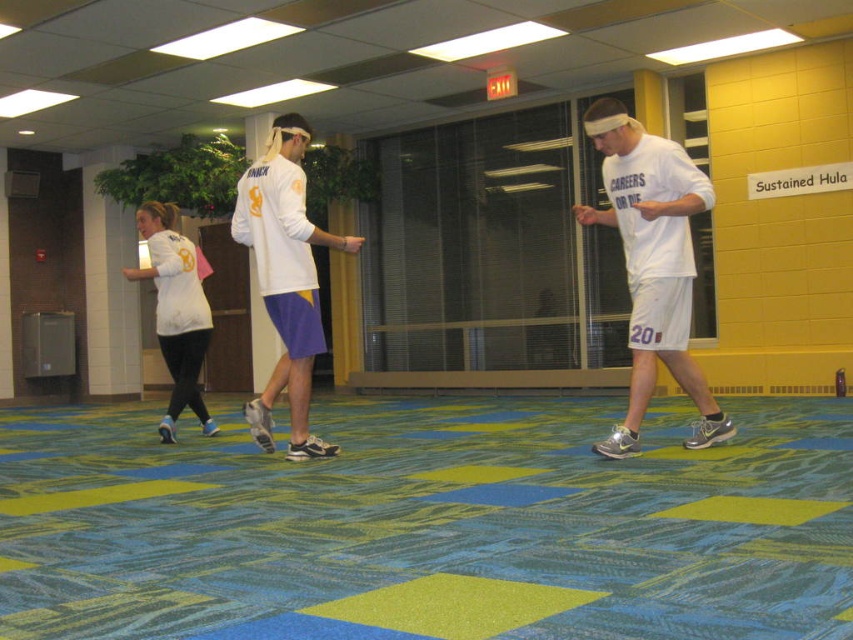
You are trying to pack your sports gear into a small bag. You have both the white matte shorts at center and the white matte jersey at center. Based on their sizes, which one should you place first to ensure they both fit?

The white matte shorts at center might be wider than the white matte jersey at center, so you should place the wider shorts first to make space for the jersey.

You are standing in the center of the room and want to place a small object exactly where the white matte shorts at center are located. What coordinates should you aim for?

You should aim for the coordinates point at (653, 262) where the white matte shorts at center are located.

You are standing in the center of the room and want to place a small plant pot exactly at the point marked as point (653,262). What object is currently at that location?

The white matte shorts at center are located at point (653,262), so placing the plant pot there would require moving the white matte shorts at center first.